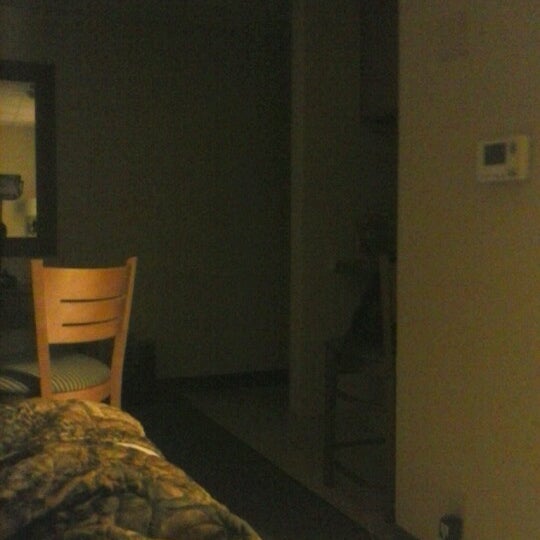
Locate an element on the screen. hallway is located at coordinates (273, 324), (275, 388), (275, 282).